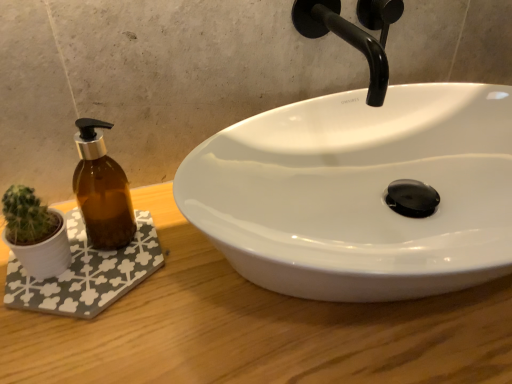
The height and width of the screenshot is (384, 512). What are the coordinates of `spots to the right of white fabric bath mat at lower left` in the screenshot? It's located at (216, 300).